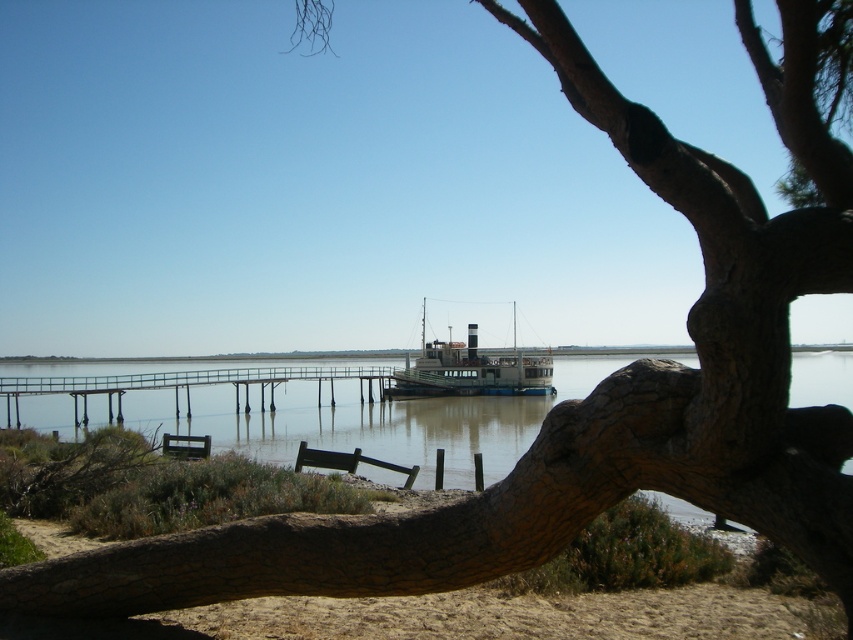
Is greenish metallic boat at center positioned in front of wooden park bench at lower center?

That is False.

How distant is greenish metallic boat at center from wooden park bench at lower center?

80.18 feet

Which is in front, point (404, 381) or point (383, 461)?

Point (383, 461) is in front.

Identify the location of greenish metallic boat at center. The width and height of the screenshot is (853, 640). (473, 371).

Does wooden pier at center have a lesser height compared to greenish metallic boat at center?

Correct, wooden pier at center is not as tall as greenish metallic boat at center.

Can you confirm if wooden pier at center is positioned to the left of greenish metallic boat at center?

Indeed, wooden pier at center is positioned on the left side of greenish metallic boat at center.

Between point (160, 403) and point (492, 364), which one is positioned behind?

The point (492, 364) is behind.

Locate an element on the screen. This screenshot has height=640, width=853. wooden pier at center is located at coordinates (189, 388).

Between greenish metallic boat at center and wooden park bench at lower left, which one has less height?

wooden park bench at lower left is shorter.

Who is lower down, greenish metallic boat at center or wooden park bench at lower left?

wooden park bench at lower left

Between point (515, 380) and point (190, 451), which one is positioned behind?

Positioned behind is point (515, 380).

Find the location of `greenish metallic boat at center`. greenish metallic boat at center is located at coordinates (473, 371).